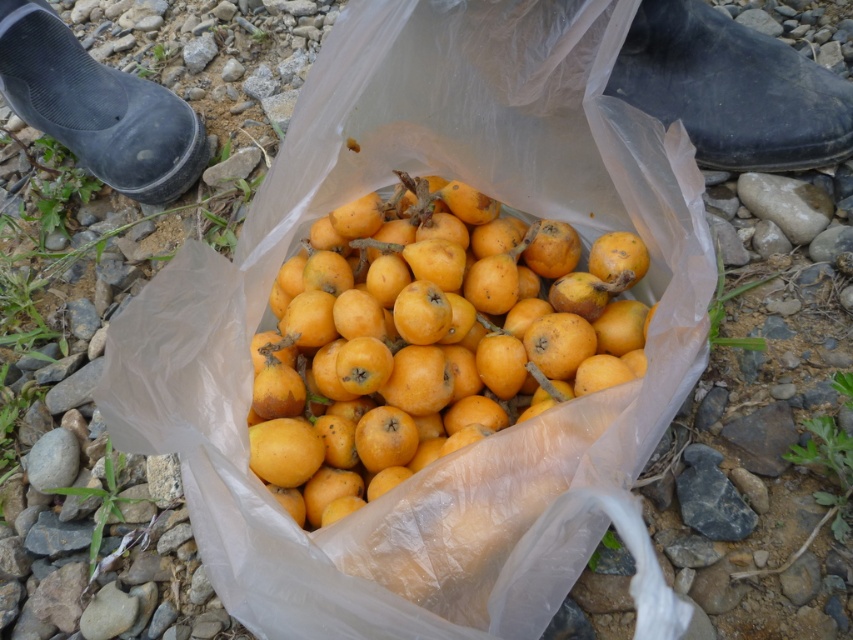
Question: Considering the relative positions of orange matte fruit at center and black rubber boot at upper left in the image provided, where is orange matte fruit at center located with respect to black rubber boot at upper left?

Choices:
 (A) right
 (B) left

Answer: (A)

Question: Which object appears farthest from the camera in this image?

Choices:
 (A) orange matte fruit at center
 (B) black rubber boot at upper left

Answer: (B)

Question: Observing the image, what is the correct spatial positioning of orange matte fruit at center in reference to black rubber boot at upper left?

Choices:
 (A) right
 (B) left

Answer: (A)

Question: Which of the following is the farthest from the observer?

Choices:
 (A) black rubber boot at upper left
 (B) orange matte fruit at center

Answer: (A)

Question: Can you confirm if orange matte fruit at center is positioned to the right of black rubber boot at upper left?

Choices:
 (A) no
 (B) yes

Answer: (B)